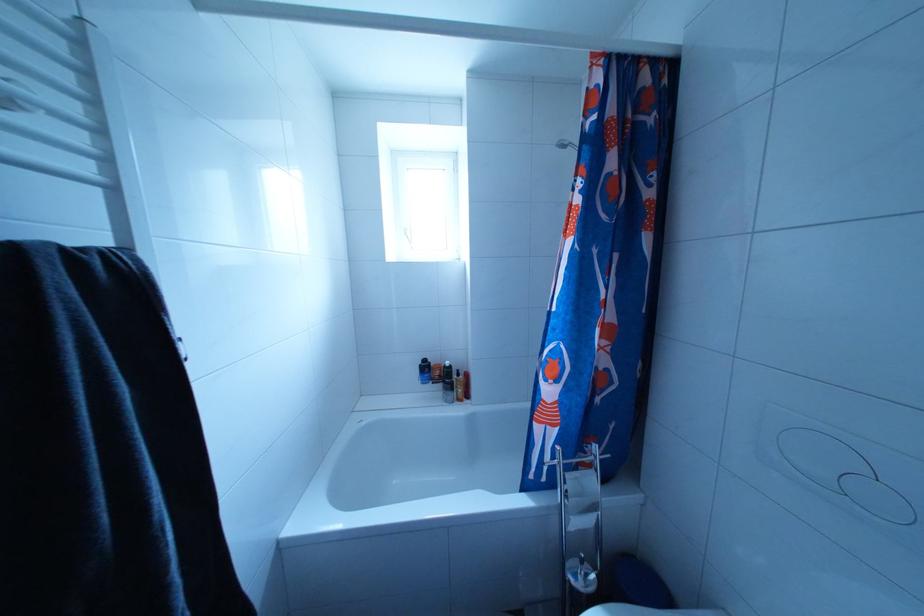
Where would you press the small flush button? Please return your answer as a coordinate pair (x, y).

(180, 349)